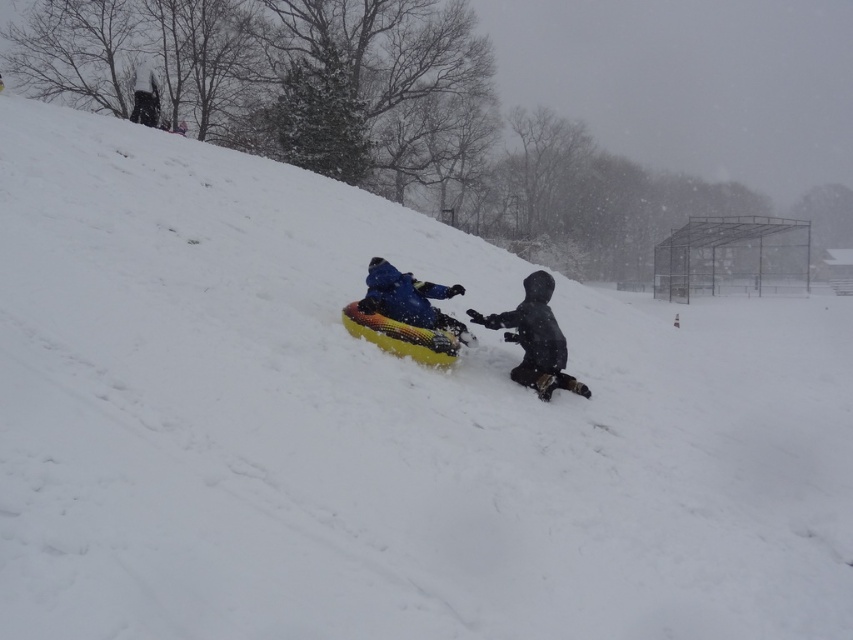
How much distance is there between black matte snowsuit at lower right and blue fabric jacket at center?

They are 99.58 centimeters apart.

Which of these two, black matte snowsuit at lower right or blue fabric jacket at center, stands taller?

With more height is black matte snowsuit at lower right.

Who is more forward, [514,312] or [372,285]?

Point [372,285]

The width and height of the screenshot is (853, 640). What are the coordinates of `black matte snowsuit at lower right` in the screenshot? It's located at (535, 339).